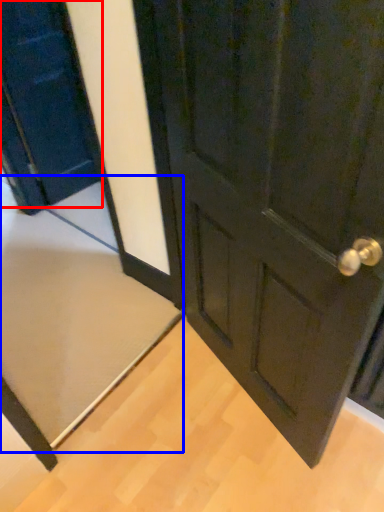
Question: Among these objects, which one is farthest to the camera, door (highlighted by a red box) or doormat (highlighted by a blue box)?

Choices:
 (A) door
 (B) doormat

Answer: (B)